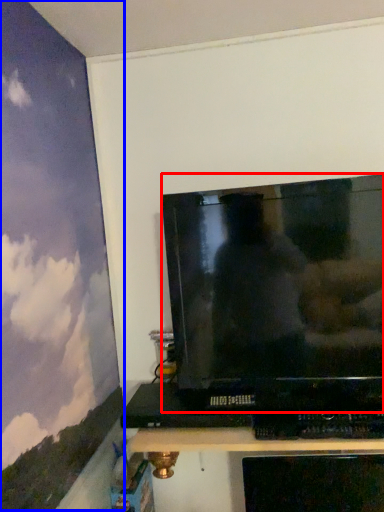
Question: Which object appears closest to the camera in this image, television (highlighted by a red box) or backdrop (highlighted by a blue box)?

Choices:
 (A) television
 (B) backdrop

Answer: (B)